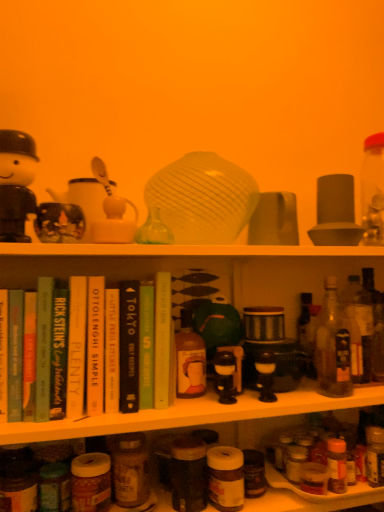
Find the location of a particular element. Image resolution: width=384 pixels, height=512 pixels. vacant region to the right of green matte book at center, which appears as the 2th book when viewed from the right is located at coordinates (213, 402).